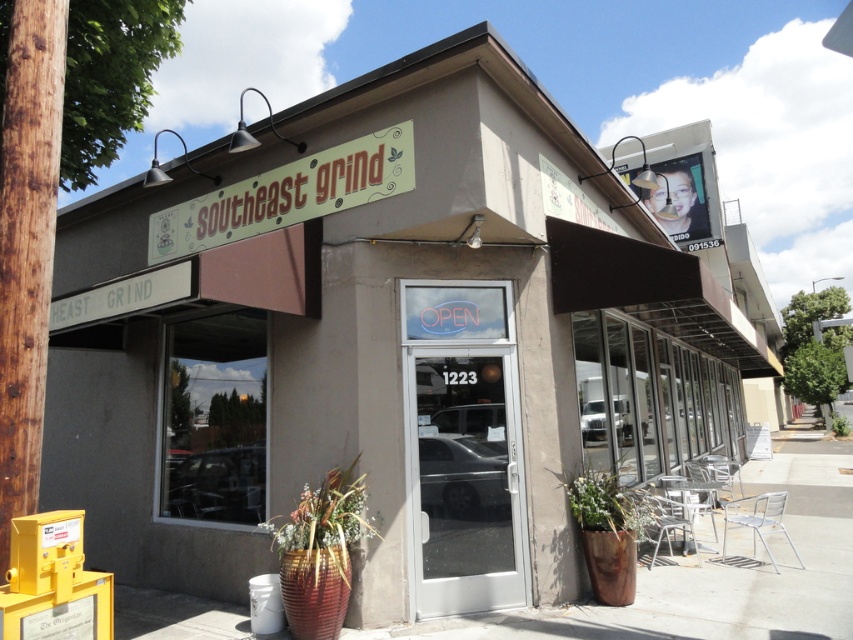
From the picture: Which of these two, brown wood pole at left or white painted wood signboard at upper center, stands shorter?

Standing shorter between the two is white painted wood signboard at upper center.

Can you confirm if brown wood pole at left is positioned to the left of white painted wood signboard at upper center?

Yes, brown wood pole at left is to the left of white painted wood signboard at upper center.

At what (x,y) coordinates should I click in order to perform the action: click on brown wood pole at left. Please return your answer as a coordinate pair (x, y). The width and height of the screenshot is (853, 640). Looking at the image, I should click on (27, 244).